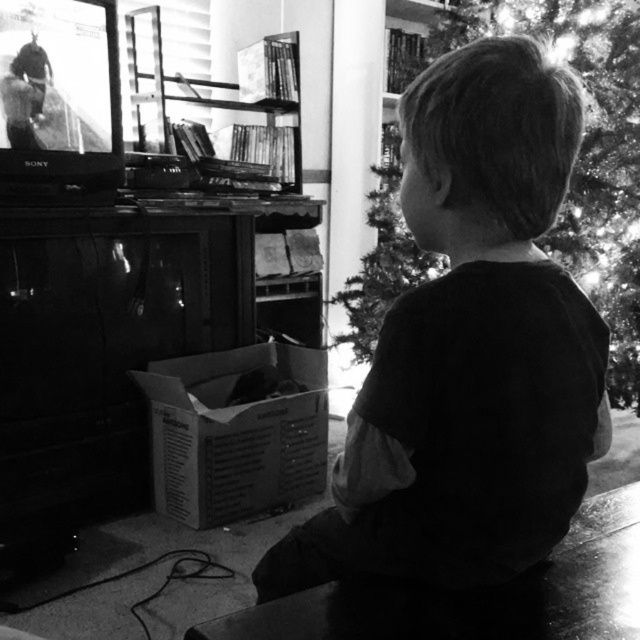
Does dark cotton shirt at center have a greater width compared to shiny metallic tree at center?

No, dark cotton shirt at center is not wider than shiny metallic tree at center.

Does point (356, 532) come farther from viewer compared to point (541, 28)?

No, it is in front of (541, 28).

Who is more distant from viewer, (474, 205) or (632, 340)?

The point (632, 340) is more distant.

Locate an element on the screen. This screenshot has width=640, height=640. dark cotton shirt at center is located at coordinates (468, 348).